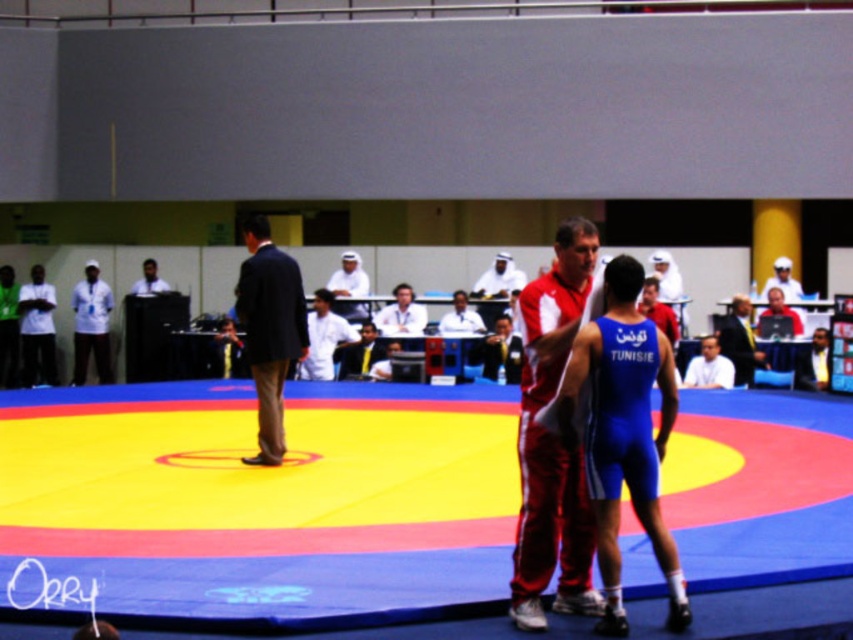
You are a photographer positioned at the back of the arena. You need to capture a photo of both the dark suit at center and the blue fabric suit at center. Based on their positions, which one is closer to the camera?

The dark suit at center is above the blue fabric suit at center, so the dark suit at center is closer to the camera.

Consider the image. You are a photographer positioned at the bottom edge of the wrestling mat. You want to take a photo of the red track suit at center so that it is centered in your viewfinder. According to the coordinate system where the bottom left corner is the origin, what are the coordinates you should aim for?

The coordinates to aim for are approximately 0.689 on the x axis and 0.648 on the y axis, as the red track suit at center is located at point (552,440).